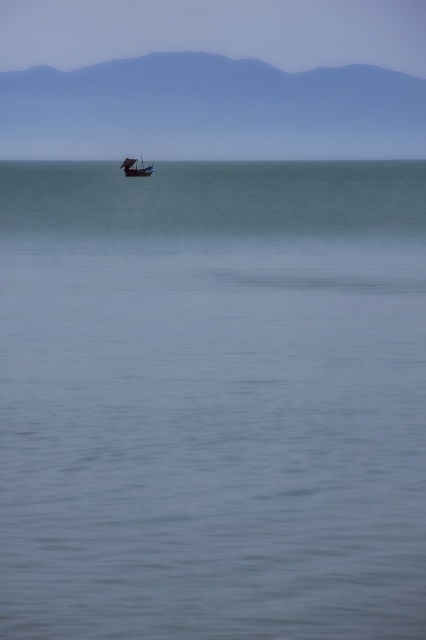
You are a photographer planning to capture the wooden boat at center in the image. Since you want to emphasize the boat, which object should you focus on to ensure it stands out against the blue smooth water at center?

The blue smooth water at center has a larger size compared to wooden boat at center, so focusing on the wooden boat at center will help it stand out against the larger water area.

You are an artist trying to paint the seascape shown. You want to place the horizon line exactly where the blue smooth water at center meets the sky. Based on the image, where should you position the horizon line in terms of coordinates?

The blue smooth water at center is located at coordinates point [213,401], so the horizon line should be placed at that point to accurately depict where the water meets the sky.

You are standing on the shore looking out at the blue smooth water at center and the wooden boat at center. Which object is closer to the horizon?

The wooden boat at center is closer to the horizon than the blue smooth water at center because the blue smooth water at center is below the wooden boat at center.